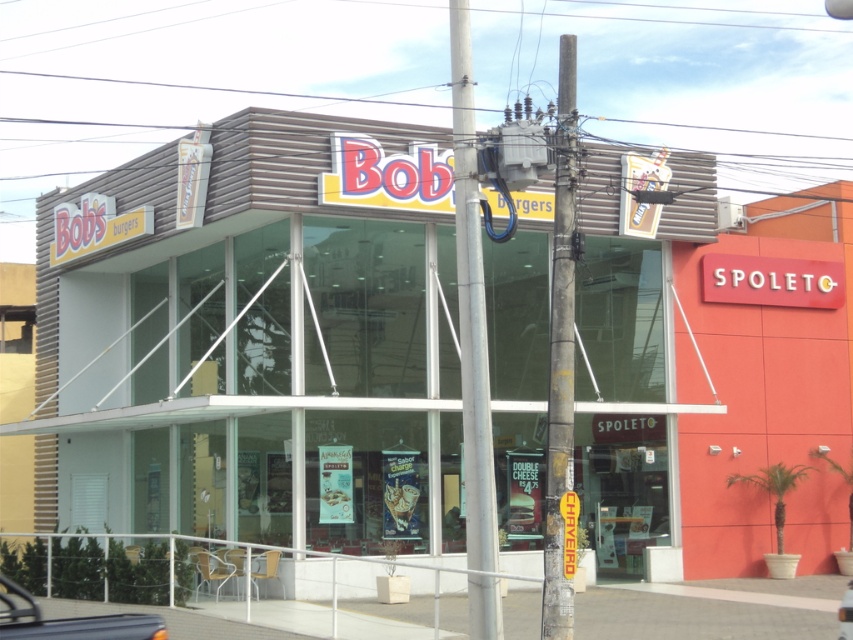
From the picture: You are standing at the entrance of Bob s Burgers and want to walk straight ahead towards the middle of the building. Is the rusty metal pole at center in your path?

The rusty metal pole at center is located at point (561,353), so yes, it is in your path as you walk straight ahead from the entrance of Bob s Burgers towards the middle of the building.

You are a pedestrian standing at the crosswalk in front of the commercial building. You want to enter the matte brown building at center. Should you walk towards the metallic silver car at lower left or around it?

The matte brown building at center is located above the metallic silver car at lower left, so the car is parked in front of the building. To enter the matte brown building at center, you should walk around the metallic silver car at lower left to reach the entrance.